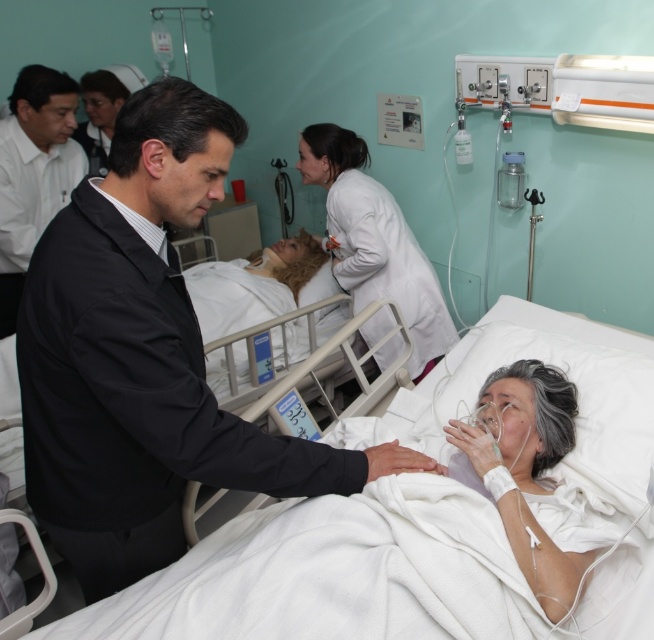
You are a nurse in the hospital room. You need to place a thin medical tool between the white smooth shirt at upper left and the smooth white pillow at center. Which object should you place it next to to ensure it fits? Please choose between the two objects.

The white smooth shirt at upper left is thinner than the smooth white pillow at center, so the medical tool should be placed next to the white smooth shirt at upper left to ensure it fits.

You are a healthcare worker who needs to reach both the white matte coat at center and the white smooth lab coat at center quickly. Which coat should you grab first if you want to minimize your walking distance?

Both the white matte coat at center and the white smooth lab coat at center are located at the center of the scene, so they are equidistant from your current position. However, since they are 4.24 feet apart from each other, you can choose either one without significantly increasing your walking distance.

You are a patient in the hospital and need to choose a coat to wear over your hospital gown. There are two coats available in the center of the room. Which coat is wider, the white matte coat at center or the white smooth lab coat at center?

The white matte coat at center is wider than the white smooth lab coat at center according to the description.